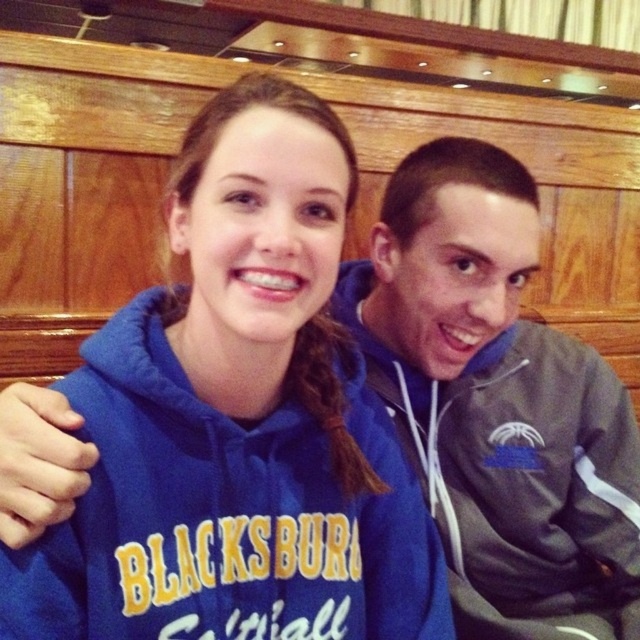
Does blue fleece sweatshirt at center have a greater width compared to gray fleece jacket at center?

No.

Which is behind, point (234, 115) or point (525, 394)?

Positioned behind is point (525, 394).

Identify the location of blue fleece sweatshirt at center. (237, 420).